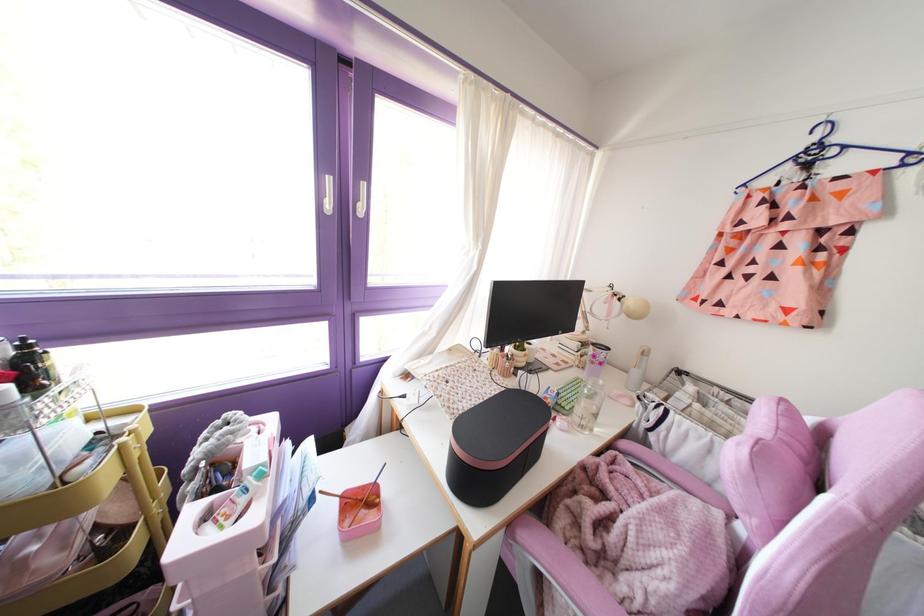
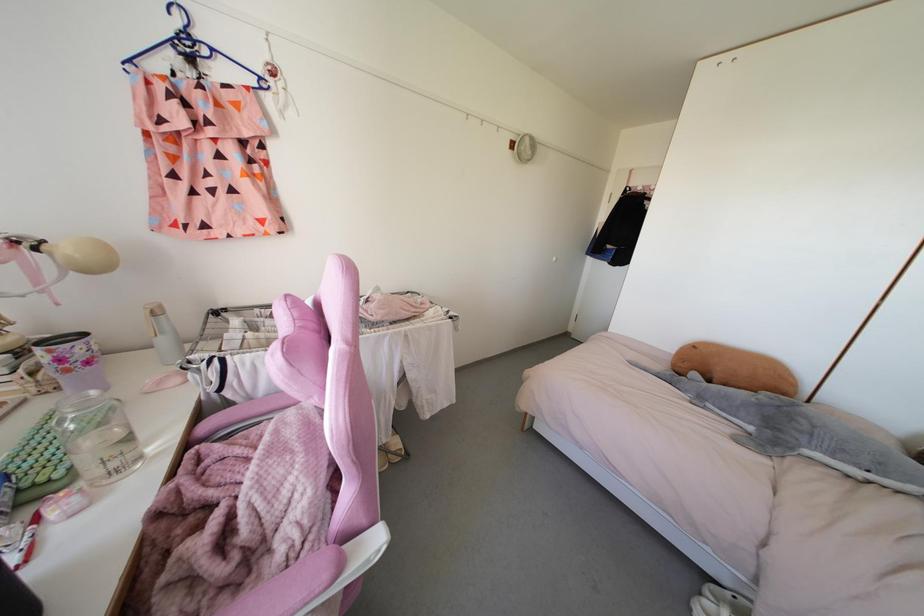
Locate, in the second image, the point that corresponds to [625,445] in the first image.

(204, 426)